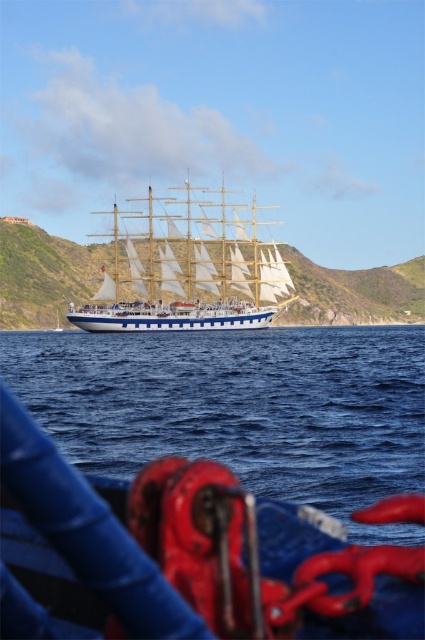
You are standing on the deck of the large multi masted ship in the image. You see a point at coordinates (240,406). What is located at that point?

The point at coordinates (240,406) indicates blue water at center.

You are standing on the deck of the ship and want to take a photo of the point at coordinates (187, 440). If your camera can focus on objects up to 200 feet away, will you be able to capture the point clearly?

The point at coordinates (187, 440) is 218.62 feet away from the camera, which exceeds the camera maximum focus distance of 200 feet. Therefore, the point cannot be captured clearly.

You are a sailor on the white wooden ship at center and need to navigate through the blue water at center. Considering the size difference between them, which one do you think will be easier to maneuver around?

The blue water at center has a smaller size compared to the white wooden ship at center, so it might be easier to maneuver around the blue water at center since it is smaller in size.